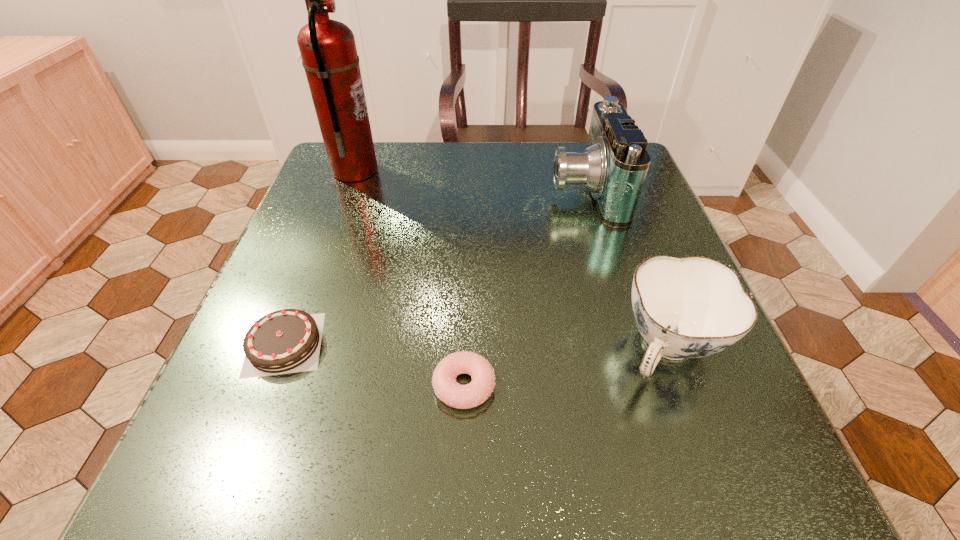
What are the coordinates of `vacant space at the far edge` in the screenshot? It's located at (411, 165).

This screenshot has width=960, height=540. What are the coordinates of `free location at the near edge of the desktop` in the screenshot? It's located at (497, 476).

In the image, there is a desktop. Where is `vacant space at the left edge`? This screenshot has width=960, height=540. vacant space at the left edge is located at coordinates (350, 299).

Identify the location of free location at the right edge of the desktop. This screenshot has height=540, width=960. (622, 265).

Find the location of `vacant space at the far left corner of the desktop`. vacant space at the far left corner of the desktop is located at coordinates (342, 182).

You are a GUI agent. You are given a task and a screenshot of the screen. Output one action in this format:
    pyautogui.click(x=<x>, y=<y>)
    Task: Click on the vacant space at the near left corner
    Image resolution: width=960 pixels, height=540 pixels.
    Given the screenshot: What is the action you would take?
    pyautogui.click(x=190, y=497)

Where is `vacant space at the far right corner`? The height and width of the screenshot is (540, 960). vacant space at the far right corner is located at coordinates (579, 190).

You are a GUI agent. You are given a task and a screenshot of the screen. Output one action in this format:
    pyautogui.click(x=<x>, y=<y>)
    Task: Click on the empty space that is in between the chinaware and the chocolate cake
    This screenshot has width=960, height=540.
    Given the screenshot: What is the action you would take?
    pyautogui.click(x=477, y=346)

Locate an element on the screen. The width and height of the screenshot is (960, 540). free space between the fire extinguisher and the chinaware is located at coordinates (512, 259).

Image resolution: width=960 pixels, height=540 pixels. I want to click on blank region between the chocolate cake and the fourth shortest object, so click(435, 267).